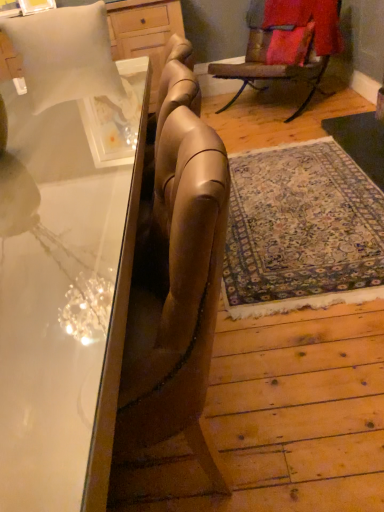
Measure the distance between point (290, 45) and camera.

A distance of 3.48 meters exists between point (290, 45) and camera.

The width and height of the screenshot is (384, 512). Find the location of `wooden rocking chair at upper right`. wooden rocking chair at upper right is located at coordinates (286, 44).

Consider the image. Is wooden rocking chair at upper right looking in the opposite direction of white matte pillow at upper left, placed as the 2th pillow when sorted from back to front?

No, white matte pillow at upper left, placed as the 2th pillow when sorted from back to front, is not at the back of wooden rocking chair at upper right.

Are wooden rocking chair at upper right and white matte pillow at upper left, which is the second pillow in right-to-left order, making contact?

No, wooden rocking chair at upper right is not with white matte pillow at upper left, which is the second pillow in right-to-left order.

From a real-world perspective, who is located higher, wooden rocking chair at upper right or white matte pillow at upper left, acting as the 1th pillow starting from the front?

white matte pillow at upper left, acting as the 1th pillow starting from the front, from a real-world perspective.

Is wooden rocking chair at upper right thinner than white matte pillow at upper left, which is counted as the 1th pillow, starting from the left?

Indeed, wooden rocking chair at upper right has a lesser width compared to white matte pillow at upper left, which is counted as the 1th pillow, starting from the left.

From a real-world perspective, is white matte pillow at upper left, the 2th pillow viewed from the top, on top of clear glass desk at left?

Yes.

Could you tell me if white matte pillow at upper left, placed as the 2th pillow when sorted from back to front, is facing clear glass desk at left?

Yes, white matte pillow at upper left, placed as the 2th pillow when sorted from back to front, is facing clear glass desk at left.

Which of these two, white matte pillow at upper left, which is the second pillow in right-to-left order, or clear glass desk at left, is thinner?

white matte pillow at upper left, which is the second pillow in right-to-left order.

Looking at this image, is clear glass desk at left a part of white matte pillow at upper left, acting as the 1th pillow starting from the front?

Result: No, clear glass desk at left is not inside white matte pillow at upper left, acting as the 1th pillow starting from the front.

Which object is positioned more to the left, clear glass desk at left or white matte pillow at upper left, the 2th pillow viewed from the top?

white matte pillow at upper left, the 2th pillow viewed from the top.

Which object is closer to the camera, clear glass desk at left or white matte pillow at upper left, acting as the 1th pillow starting from the front?

Positioned in front is clear glass desk at left.

Does point (70, 50) lie behind point (61, 9)?

No, it is in front of (61, 9).

Is clear glass desk at left facing away from white matte pillow at upper left, which is counted as the 1th pillow, starting from the left?

No.

Consider the image. Is velvet red pillow at upper right, the second pillow when ordered from front to back, directly adjacent to clear glass desk at left?

No, velvet red pillow at upper right, the second pillow when ordered from front to back, is not touching clear glass desk at left.

From a real-world perspective, is velvet red pillow at upper right, which is the 2th pillow in left-to-right order, under clear glass desk at left?

Incorrect, from a real-world perspective, velvet red pillow at upper right, which is the 2th pillow in left-to-right order, is higher than clear glass desk at left.

Is point (285, 49) farther from camera compared to point (83, 307)?

Yes, point (285, 49) is farther from viewer.

Is velvet red pillow at upper right, marked as the first pillow in a right-to-left arrangement, turned away from clear glass desk at left?

No.

Does point (215, 68) lie in front of point (251, 60)?

Yes, point (215, 68) is in front of point (251, 60).

Is wooden rocking chair at upper right bigger or smaller than velvet red pillow at upper right, marked as the first pillow in a right-to-left arrangement?

Clearly, wooden rocking chair at upper right is larger in size than velvet red pillow at upper right, marked as the first pillow in a right-to-left arrangement.

Based on the photo, does wooden rocking chair at upper right have a greater height compared to velvet red pillow at upper right, marked as the first pillow in a right-to-left arrangement?

Yes, wooden rocking chair at upper right is taller than velvet red pillow at upper right, marked as the first pillow in a right-to-left arrangement.

Considering the sizes of objects clear glass desk at left and wooden rocking chair at upper right in the image provided, who is thinner, clear glass desk at left or wooden rocking chair at upper right?

wooden rocking chair at upper right.

Looking at this image, does clear glass desk at left have a lesser height compared to wooden rocking chair at upper right?

No.

Is clear glass desk at left at the right side of wooden rocking chair at upper right?

No.

Is velvet red pillow at upper right, arranged as the first pillow when viewed from the top, far from white matte pillow at upper left, which is the first pillow in bottom-to-top order?

Yes, velvet red pillow at upper right, arranged as the first pillow when viewed from the top, and white matte pillow at upper left, which is the first pillow in bottom-to-top order, are located far from each other.

Is velvet red pillow at upper right, arranged as the first pillow when viewed from the top, aimed at white matte pillow at upper left, which is counted as the 1th pillow, starting from the left?

Yes, velvet red pillow at upper right, arranged as the first pillow when viewed from the top, is oriented towards white matte pillow at upper left, which is counted as the 1th pillow, starting from the left.

Which of these two, velvet red pillow at upper right, arranged as the first pillow when viewed from the top, or white matte pillow at upper left, placed as the 2th pillow when sorted from back to front, stands taller?

white matte pillow at upper left, placed as the 2th pillow when sorted from back to front, is taller.

The height and width of the screenshot is (512, 384). I want to click on pillow to the left of wooden rocking chair at upper right, so click(x=66, y=55).

I want to click on pillow that is the 1st one when counting upward from the clear glass desk at left (from the image's perspective), so click(x=66, y=55).

Estimate the real-world distances between objects in this image. Which object is further from velvet red pillow at upper right, arranged as the first pillow when viewed from the top, wooden rocking chair at upper right or clear glass desk at left?

clear glass desk at left lies further to velvet red pillow at upper right, arranged as the first pillow when viewed from the top, than the other object.

Estimate the real-world distances between objects in this image. Which object is closer to clear glass desk at left, white matte pillow at upper left, which is the first pillow in bottom-to-top order, or wooden rocking chair at upper right?

white matte pillow at upper left, which is the first pillow in bottom-to-top order, lies closer to clear glass desk at left than the other object.

Looking at the image, which one is located further to wooden rocking chair at upper right, clear glass desk at left or velvet red pillow at upper right, arranged as the first pillow when viewed from the top?

The object further to wooden rocking chair at upper right is clear glass desk at left.

Consider the image. From the image, which object appears to be farther from velvet red pillow at upper right, the second pillow when ordered from front to back, clear glass desk at left or white matte pillow at upper left, the 2th pillow viewed from the top?

clear glass desk at left lies further to velvet red pillow at upper right, the second pillow when ordered from front to back, than the other object.

Looking at the image, which one is located further to velvet red pillow at upper right, which is the 2th pillow in left-to-right order, white matte pillow at upper left, which is counted as the 1th pillow, starting from the left, or wooden rocking chair at upper right?

Among the two, white matte pillow at upper left, which is counted as the 1th pillow, starting from the left, is located further to velvet red pillow at upper right, which is the 2th pillow in left-to-right order.

Based on their spatial positions, is velvet red pillow at upper right, marked as the first pillow in a right-to-left arrangement, or wooden rocking chair at upper right closer to white matte pillow at upper left, which is counted as the 1th pillow, starting from the left?

wooden rocking chair at upper right lies closer to white matte pillow at upper left, which is counted as the 1th pillow, starting from the left, than the other object.

Looking at the image, which one is located closer to wooden rocking chair at upper right, white matte pillow at upper left, which is the first pillow in bottom-to-top order, or velvet red pillow at upper right, which is the 2th pillow in left-to-right order?

velvet red pillow at upper right, which is the 2th pillow in left-to-right order.

Considering their positions, is white matte pillow at upper left, the 2th pillow viewed from the top, positioned closer to velvet red pillow at upper right, marked as the first pillow in a right-to-left arrangement, than clear glass desk at left?

Among the two, white matte pillow at upper left, the 2th pillow viewed from the top, is located nearer to velvet red pillow at upper right, marked as the first pillow in a right-to-left arrangement.

Locate an element on the screen. Image resolution: width=384 pixels, height=512 pixels. chair situated between white matte pillow at upper left, which is counted as the 1th pillow, starting from the left, and velvet red pillow at upper right, which is the 2th pillow in left-to-right order, from left to right is located at coordinates (286, 44).

At what (x,y) coordinates should I click in order to perform the action: click on pillow positioned between clear glass desk at left and velvet red pillow at upper right, marked as the first pillow in a right-to-left arrangement, from near to far. Please return your answer as a coordinate pair (x, y). The width and height of the screenshot is (384, 512). Looking at the image, I should click on (66, 55).

Find the location of a particular element. pillow between clear glass desk at left and wooden rocking chair at upper right along the z-axis is located at coordinates (66, 55).

Image resolution: width=384 pixels, height=512 pixels. What are the coordinates of `chair between clear glass desk at left and velvet red pillow at upper right, which is the 2th pillow in left-to-right order, in the front-back direction` in the screenshot? It's located at (286, 44).